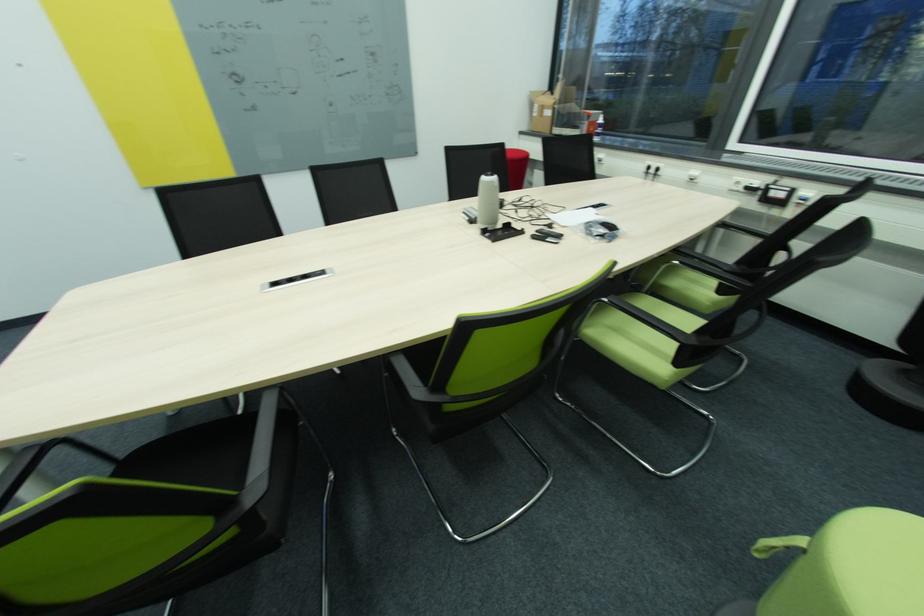
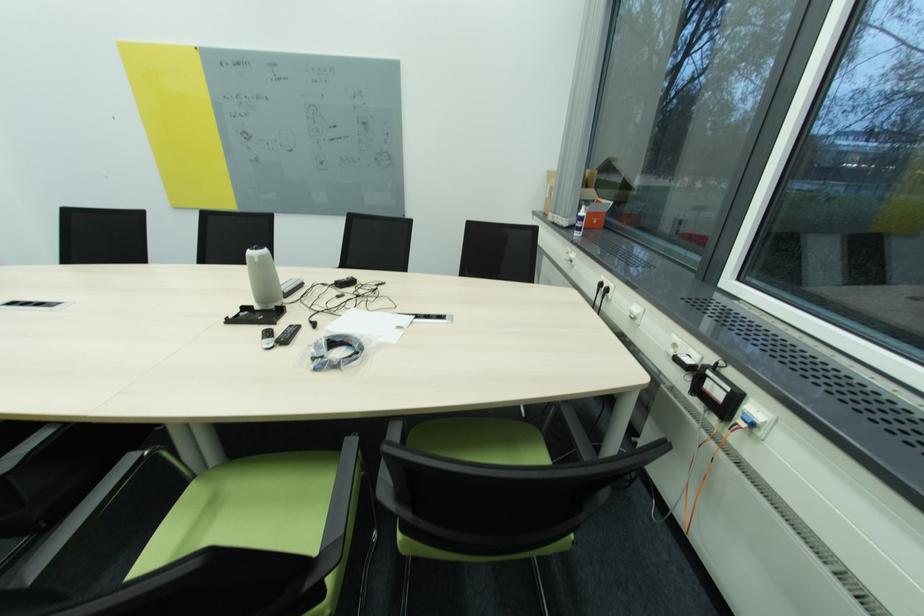
Where in the second image is the point corresponding to point 529,129 from the first image?

(544, 209)